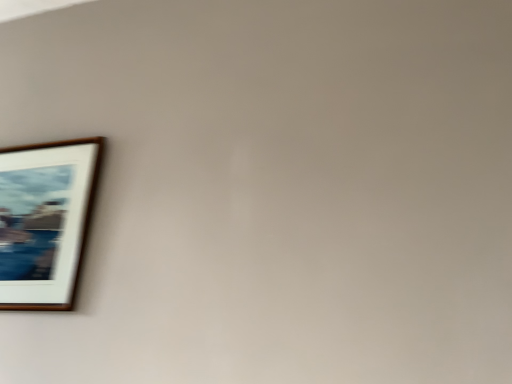
Question: Should I look upward or downward to see wooden frame at upper left?

Choices:
 (A) up
 (B) down

Answer: (B)